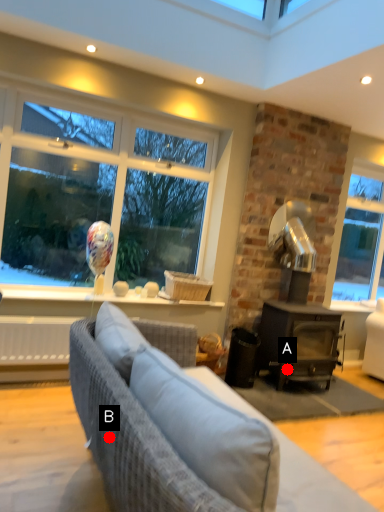
Question: Two points are circled on the image, labeled by A and B beside each circle. Among these points, which one is farthest from the camera?

Choices:
 (A) A is further
 (B) B is further

Answer: (A)